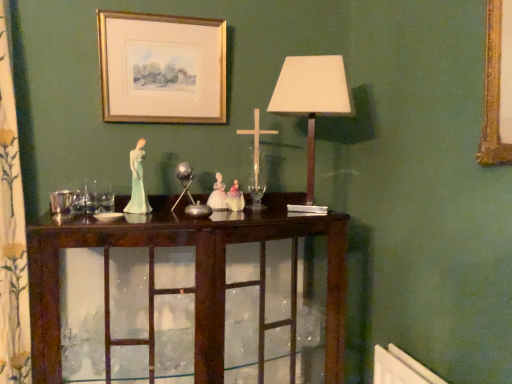
Image resolution: width=512 pixels, height=384 pixels. What do you see at coordinates (162, 68) in the screenshot? I see `gold/glossy picture frame at upper center` at bounding box center [162, 68].

Identify the location of matte white lampshade at center. This screenshot has height=384, width=512. (312, 97).

Image resolution: width=512 pixels, height=384 pixels. Describe the element at coordinates (312, 97) in the screenshot. I see `matte white lampshade at center` at that location.

Describe the element at coordinates (137, 182) in the screenshot. I see `porcelain figure at center` at that location.

Identify the location of gold/glossy picture frame at upper center. The width and height of the screenshot is (512, 384). (162, 68).

Is matte white lampshade at center situated inside dark wood cabinet at center or outside?

matte white lampshade at center is not enclosed by dark wood cabinet at center.

Is matte white lampshade at center oriented towards dark wood cabinet at center?

No, matte white lampshade at center is not facing towards dark wood cabinet at center.

From the image's perspective, relative to dark wood cabinet at center, is matte white lampshade at center above or below?

From the image's perspective, matte white lampshade at center appears above dark wood cabinet at center.

Between gold/glossy picture frame at upper center and floral-patterned fabric at left, which one is positioned behind?

gold/glossy picture frame at upper center is further away from the camera.

From a real-world perspective, between gold/glossy picture frame at upper center and floral-patterned fabric at left, who is vertically higher?

gold/glossy picture frame at upper center.

From the image's perspective, between gold/glossy picture frame at upper center and floral-patterned fabric at left, who is located below?

floral-patterned fabric at left.

From the image's perspective, is dark wood cabinet at center over porcelain figure at center?

Actually, dark wood cabinet at center appears below porcelain figure at center in the image.

Which is more to the right, dark wood cabinet at center or porcelain figure at center?

dark wood cabinet at center.

Is dark wood cabinet at center turned away from porcelain figure at center?

dark wood cabinet at center does not have its back to porcelain figure at center.

Between dark wood cabinet at center and porcelain figure at center, which one has smaller size?

porcelain figure at center.

Is floral-patterned fabric at left located within matte white lampshade at center?

No, floral-patterned fabric at left is not surrounded by matte white lampshade at center.

Would you consider matte white lampshade at center to be distant from floral-patterned fabric at left?

They are positioned close to each other.

In terms of width, does matte white lampshade at center look wider or thinner when compared to floral-patterned fabric at left?

Considering their sizes, matte white lampshade at center looks slimmer than floral-patterned fabric at left.

Can you confirm if matte white lampshade at center is thinner than gold/glossy picture frame at upper center?

Incorrect, the width of matte white lampshade at center is not less than that of gold/glossy picture frame at upper center.

Is the depth of matte white lampshade at center less than that of gold/glossy picture frame at upper center?

Yes, matte white lampshade at center is closer to the viewer.

Is matte white lampshade at center spatially inside gold/glossy picture frame at upper center, or outside of it?

matte white lampshade at center cannot be found inside gold/glossy picture frame at upper center.

In terms of size, does matte white lampshade at center appear bigger or smaller than gold/glossy picture frame at upper center?

Considering their sizes, matte white lampshade at center takes up more space than gold/glossy picture frame at upper center.

Does floral-patterned fabric at left have a lesser width compared to gold/glossy picture frame at upper center?

In fact, floral-patterned fabric at left might be wider than gold/glossy picture frame at upper center.

Is floral-patterned fabric at left placed right next to gold/glossy picture frame at upper center?

No, floral-patterned fabric at left is not with gold/glossy picture frame at upper center.

Is floral-patterned fabric at left taller than gold/glossy picture frame at upper center?

Yes.

Which object is positioned more to the right, floral-patterned fabric at left or gold/glossy picture frame at upper center?

gold/glossy picture frame at upper center.

Is gold/glossy picture frame at upper center aimed at dark wood cabinet at center?

No, gold/glossy picture frame at upper center is not facing towards dark wood cabinet at center.

Is gold/glossy picture frame at upper center next to dark wood cabinet at center?

gold/glossy picture frame at upper center and dark wood cabinet at center are not in contact.

Which object is positioned more to the left, gold/glossy picture frame at upper center or dark wood cabinet at center?

From the viewer's perspective, gold/glossy picture frame at upper center appears more on the left side.

From the image's perspective, does gold/glossy picture frame at upper center appear lower than dark wood cabinet at center?

Actually, gold/glossy picture frame at upper center appears above dark wood cabinet at center in the image.

Locate an element on the screen. table on the left of matte white lampshade at center is located at coordinates (187, 287).

Where is `curtain below the gold/glossy picture frame at upper center (from a real-world perspective)`? This screenshot has width=512, height=384. curtain below the gold/glossy picture frame at upper center (from a real-world perspective) is located at coordinates (11, 231).

Looking at the image, which one is located further to floral-patterned fabric at left, porcelain figure at center or matte white lampshade at center?

matte white lampshade at center.

Which object lies nearer to the anchor point dark wood cabinet at center, matte white lampshade at center or porcelain figure at center?

Based on the image, porcelain figure at center appears to be nearer to dark wood cabinet at center.

When comparing their distances from gold/glossy picture frame at upper center, does porcelain figure at center or matte white lampshade at center seem further?

Among the two, matte white lampshade at center is located further to gold/glossy picture frame at upper center.

Estimate the real-world distances between objects in this image. Which object is closer to porcelain figure at center, dark wood cabinet at center or floral-patterned fabric at left?

Among the two, dark wood cabinet at center is located nearer to porcelain figure at center.

Looking at the image, which one is located further to porcelain figure at center, matte white lampshade at center or floral-patterned fabric at left?

matte white lampshade at center is positioned further to the anchor porcelain figure at center.

Considering their positions, is gold/glossy picture frame at upper center positioned closer to matte white lampshade at center than dark wood cabinet at center?

gold/glossy picture frame at upper center lies closer to matte white lampshade at center than the other object.

Looking at this image, considering their positions, is matte white lampshade at center positioned further to floral-patterned fabric at left than porcelain figure at center?

The object further to floral-patterned fabric at left is matte white lampshade at center.

Considering their positions, is dark wood cabinet at center positioned closer to porcelain figure at center than matte white lampshade at center?

dark wood cabinet at center is closer to porcelain figure at center.

This screenshot has width=512, height=384. What are the coordinates of `table lamp between gold/glossy picture frame at upper center and dark wood cabinet at center in the vertical direction` in the screenshot? It's located at (312, 97).

At what (x,y) coordinates should I click in order to perform the action: click on miniature between floral-patterned fabric at left and dark wood cabinet at center in the horizontal direction. Please return your answer as a coordinate pair (x, y). Looking at the image, I should click on (137, 182).

Where is `miniature that lies between matte white lampshade at center and dark wood cabinet at center from top to bottom`? The width and height of the screenshot is (512, 384). miniature that lies between matte white lampshade at center and dark wood cabinet at center from top to bottom is located at coordinates (137, 182).

This screenshot has width=512, height=384. Identify the location of table between floral-patterned fabric at left and matte white lampshade at center. (187, 287).